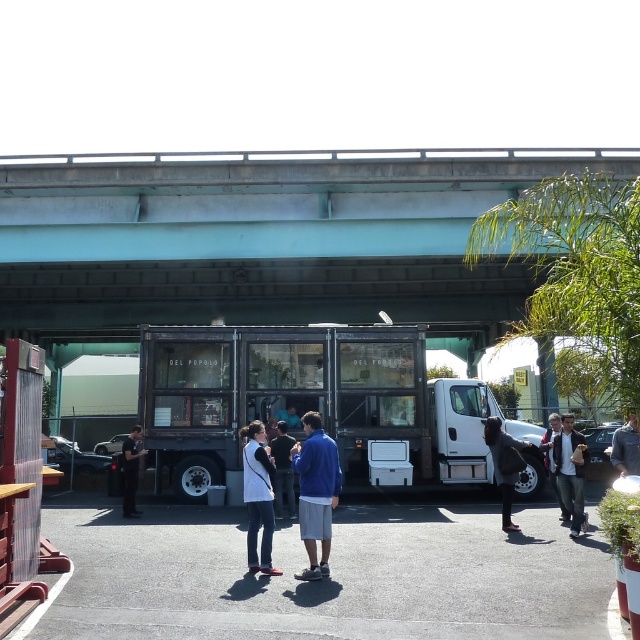
Describe the element at coordinates (312, 401) in the screenshot. The height and width of the screenshot is (640, 640). I see `wooden panel food truck at center` at that location.

Is point (145, 358) less distant than point (637, 451)?

No, it is not.

Describe the element at coordinates (312, 401) in the screenshot. Image resolution: width=640 pixels, height=640 pixels. I see `wooden panel food truck at center` at that location.

Locate an element on the screen. wooden panel food truck at center is located at coordinates pos(312,401).

Based on the photo, who is more distant from viewer, [273,524] or [634,445]?

The point [634,445] is more distant.

Can you confirm if white matte vest at center is positioned to the left of gray wool sweater at center?

Indeed, white matte vest at center is positioned on the left side of gray wool sweater at center.

What do you see at coordinates (259, 497) in the screenshot? I see `white matte vest at center` at bounding box center [259, 497].

Where is `white matte vest at center`? white matte vest at center is located at coordinates (259, 497).

Can you confirm if denim jacket at center is shorter than black leather jacket at center?

Indeed, denim jacket at center has a lesser height compared to black leather jacket at center.

Is denim jacket at center positioned at the back of black leather jacket at center?

No, it is not.

Between point (579, 477) and point (128, 480), which one is positioned in front?

Point (579, 477) is in front.

Locate an element on the screen. The height and width of the screenshot is (640, 640). denim jacket at center is located at coordinates (570, 470).